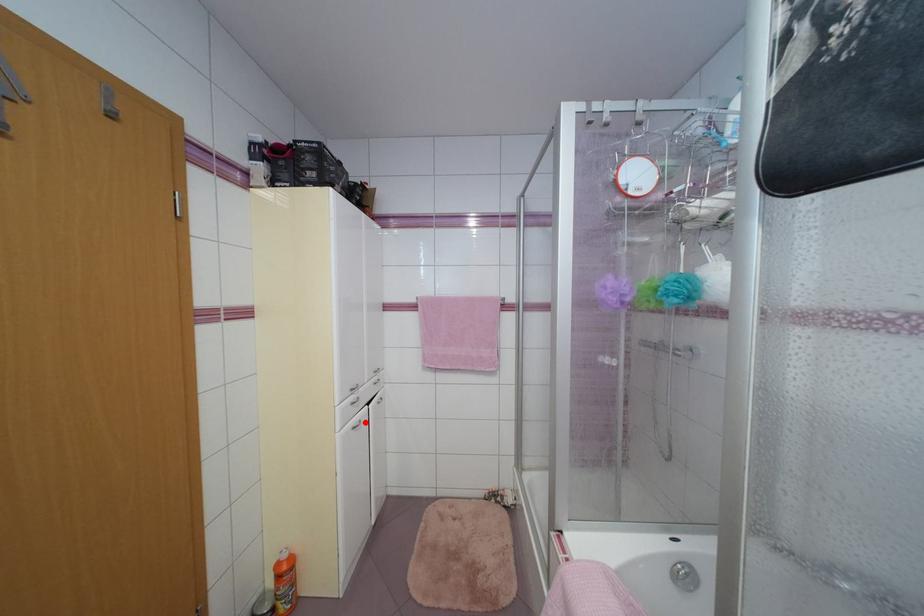
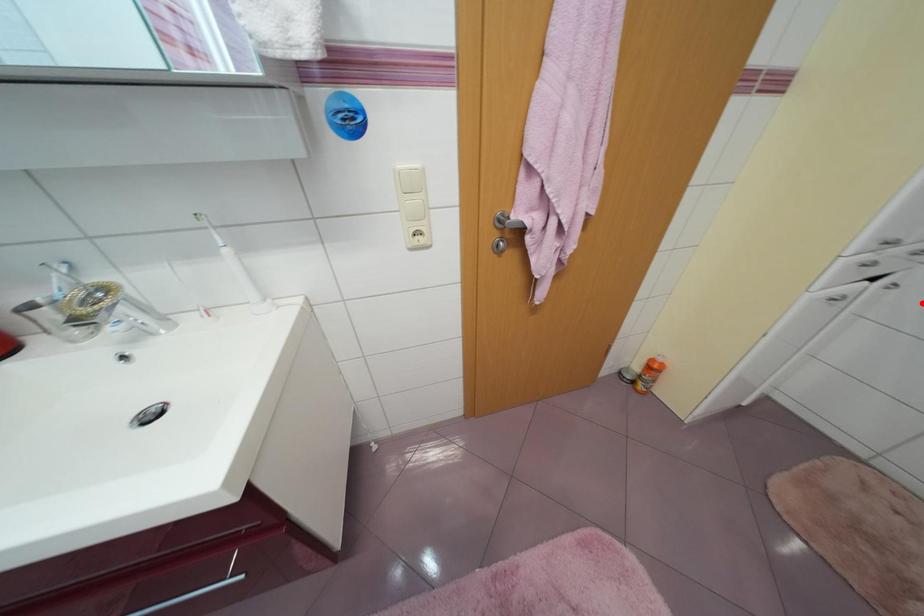
I am providing you with two images of the same scene from different viewpoints. A red point is marked on the first image and another point is marked on the second image. Does the point marked in image1 correspond to the same location as the one in image2?

No